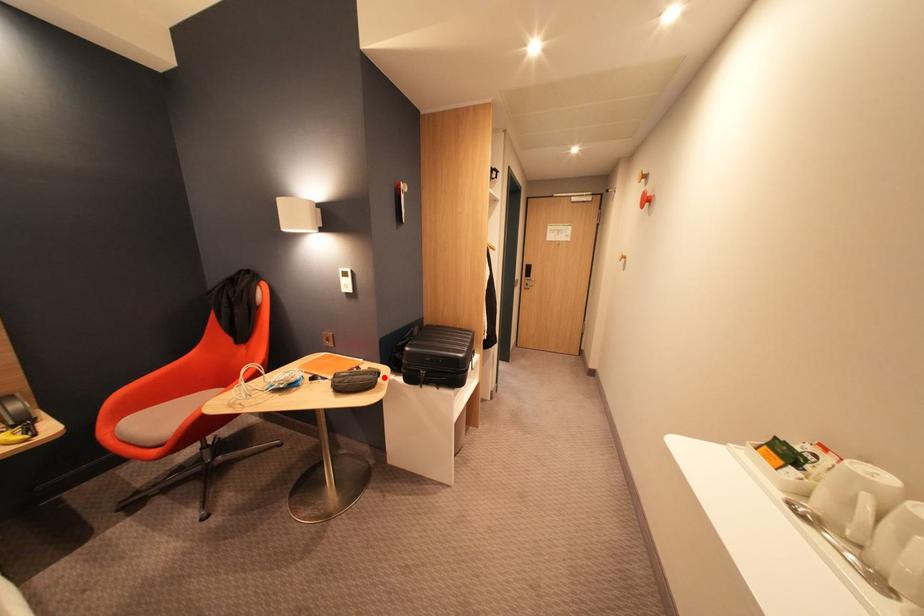
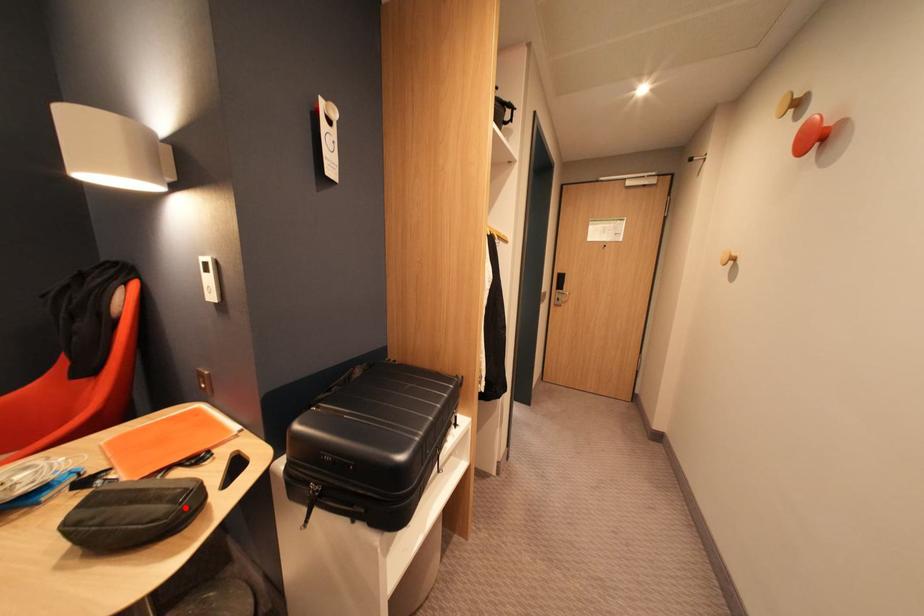
I am providing you with two images of the same scene from different viewpoints. A red point is marked on the first image and another point is marked on the second image. Is the marked point in image1 the same physical position as the marked point in image2?

Yes